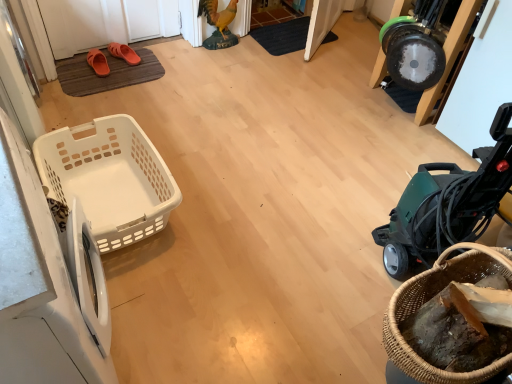
Find the location of `free spot in front of brown rubber doormat at upper left, which is the first doormat from left to right`. free spot in front of brown rubber doormat at upper left, which is the first doormat from left to right is located at coordinates (101, 109).